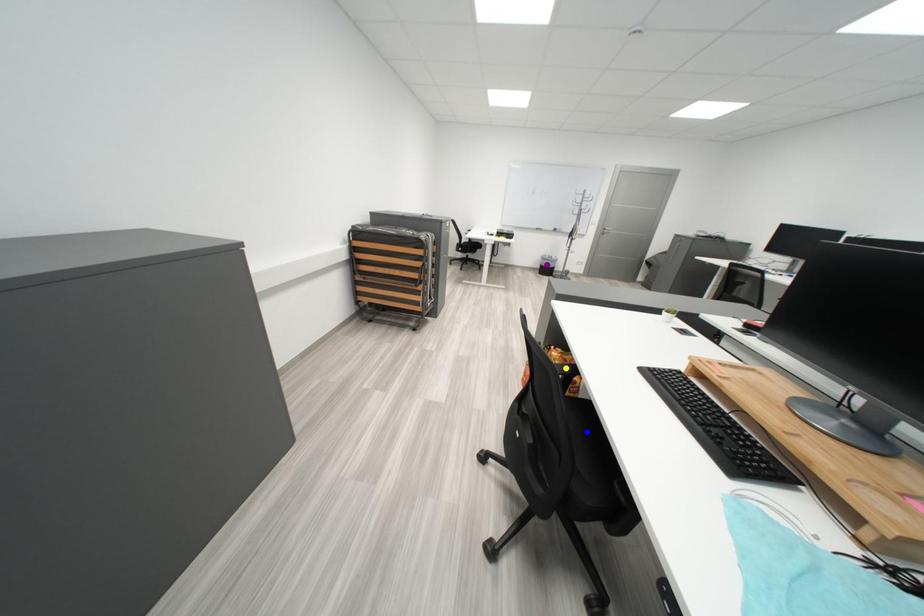
Order these from nearest to farthest:
blue point
yellow point
purple point

blue point < yellow point < purple point